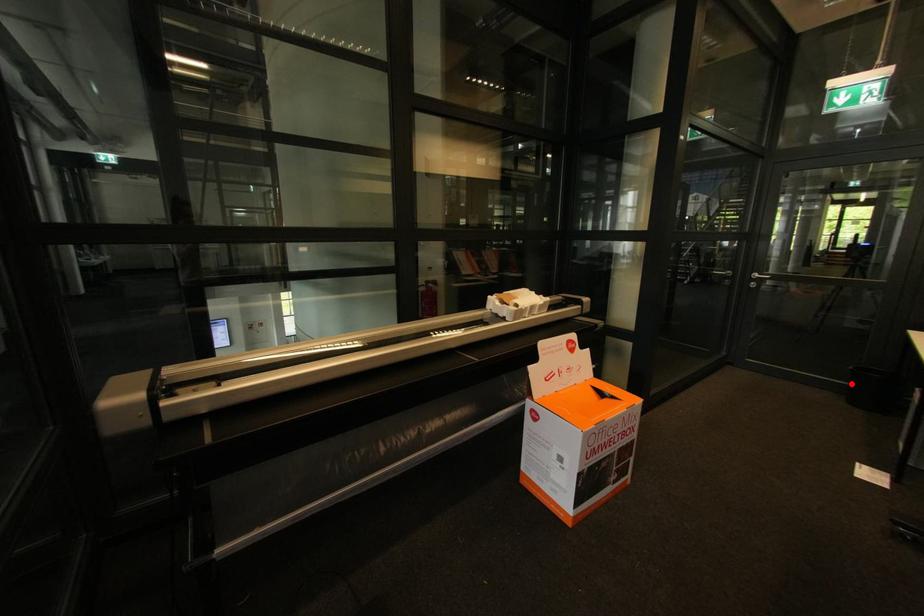
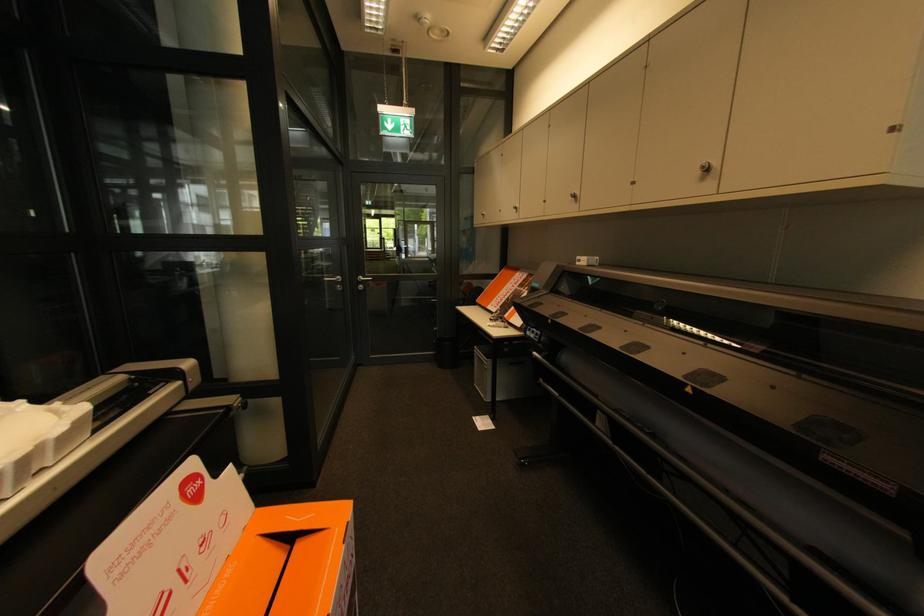
Find the pixel in the second image that matches the highlighted location in the first image.

(439, 354)